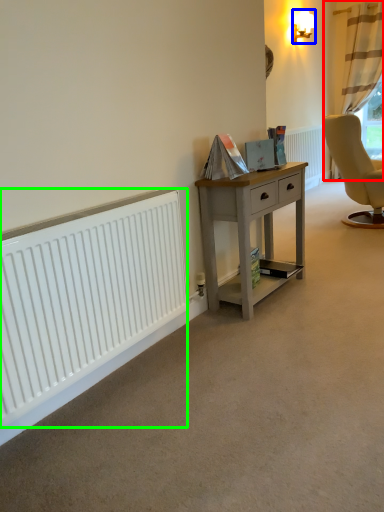
Question: Which object is positioned farthest from curtain (highlighted by a red box)? Select from lamp (highlighted by a blue box) and radiator (highlighted by a green box).

Choices:
 (A) lamp
 (B) radiator

Answer: (B)